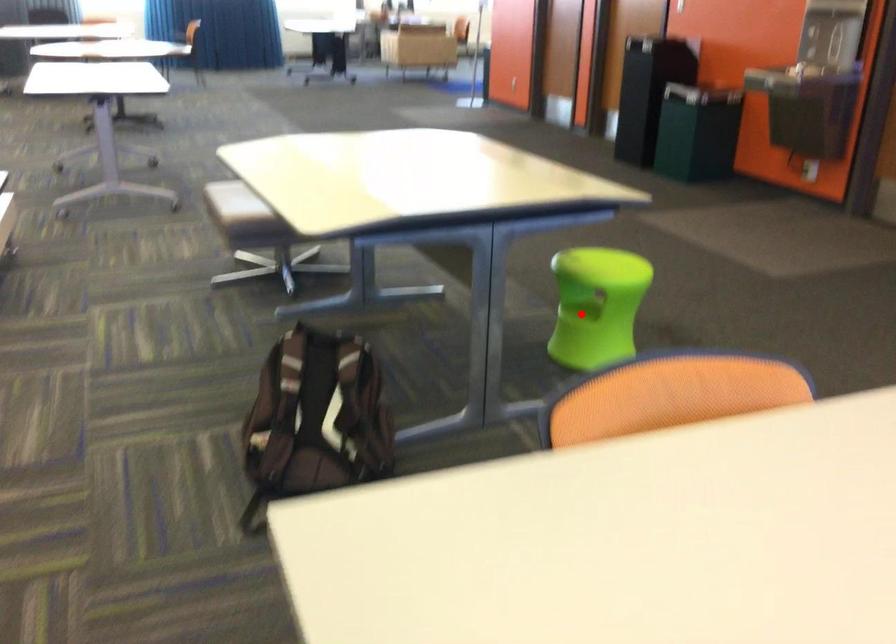
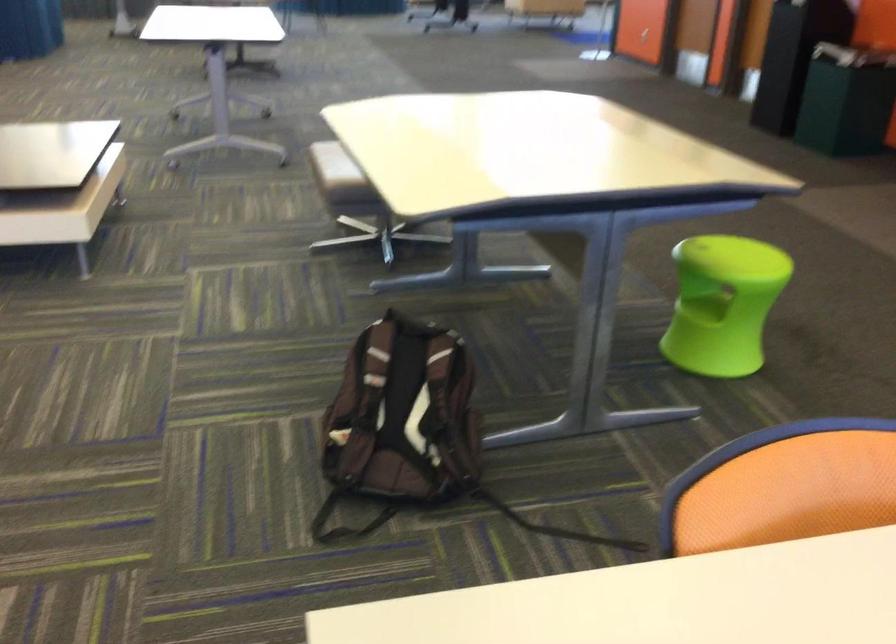
Locate, in the second image, the point that corresponds to the highlighted location in the first image.

(702, 307)